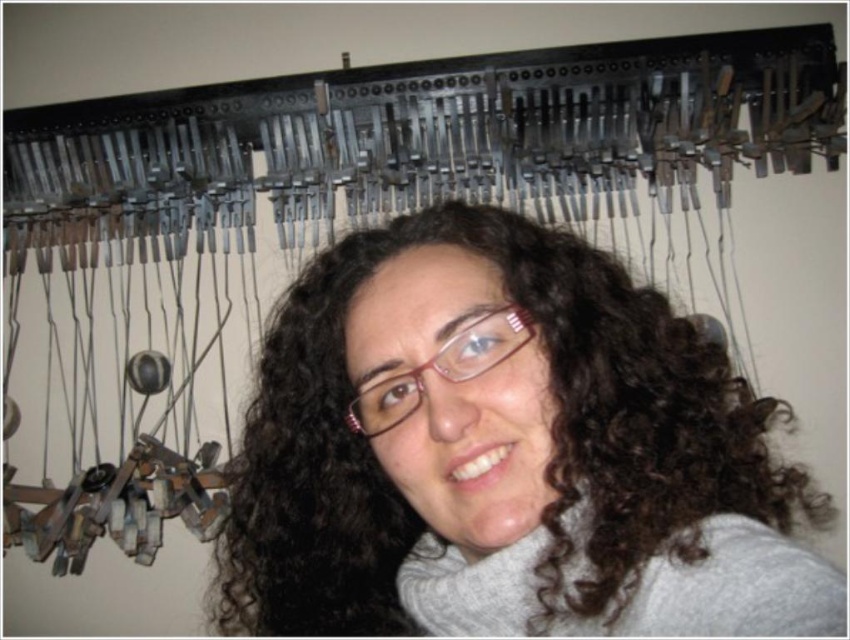
Question: Can you confirm if dark brown curly hair at center is positioned to the right of pink plastic glasses at center?

Choices:
 (A) no
 (B) yes

Answer: (B)

Question: Can you confirm if dark brown curly hair at center is wider than pink plastic glasses at center?

Choices:
 (A) yes
 (B) no

Answer: (A)

Question: Does dark brown curly hair at center have a smaller size compared to pink plastic glasses at center?

Choices:
 (A) yes
 (B) no

Answer: (B)

Question: Which point is closer to the camera?

Choices:
 (A) pink plastic glasses at center
 (B) dark brown curly hair at center

Answer: (B)

Question: Among these points, which one is nearest to the camera?

Choices:
 (A) (382, 417)
 (B) (636, 465)

Answer: (B)